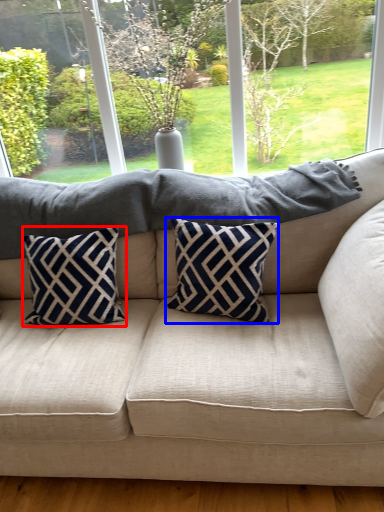
Question: Which of the following is the farthest to the observer, pillow (highlighted by a red box) or pillow (highlighted by a blue box)?

Choices:
 (A) pillow
 (B) pillow

Answer: (A)